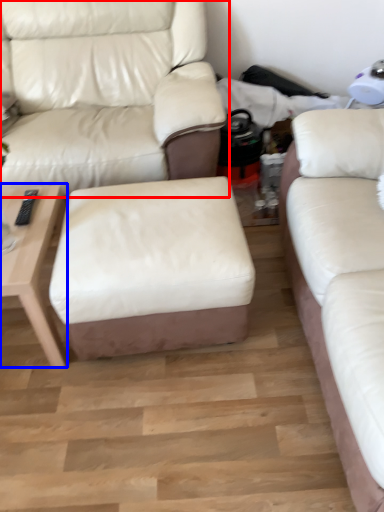
Question: Among these objects, which one is nearest to the camera, studio couch (highlighted by a red box) or table (highlighted by a blue box)?

Choices:
 (A) studio couch
 (B) table

Answer: (B)